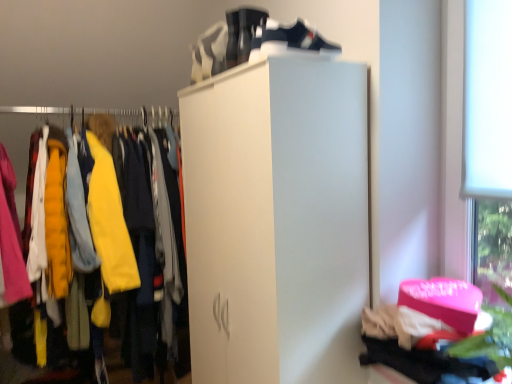
Measure the distance between point (276,28) and camera.

The distance of point (276,28) from camera is 1.25 meters.

Find the location of a particular element. The image size is (512, 384). white matte closet at left is located at coordinates (95, 218).

This screenshot has width=512, height=384. Identify the location of white matte running shoe at upper center. (242, 33).

How distant is white leather shoe at upper center from white matte running shoe at upper center?

A distance of 4.34 inches exists between white leather shoe at upper center and white matte running shoe at upper center.

Considering their positions, is white leather shoe at upper center located in front of or behind white matte running shoe at upper center?

Visually, white leather shoe at upper center is located in front of white matte running shoe at upper center.

Between white leather shoe at upper center and white matte running shoe at upper center, which one appears on the left side from the viewer's perspective?

white matte running shoe at upper center.

From a real-world perspective, which is physically below, white leather shoe at upper center or white matte running shoe at upper center?

From a 3D spatial view, white leather shoe at upper center is below.

From the picture: Can you confirm if white leather shoe at upper center is wider than white matte closet at left?

No.

Does point (291, 32) come in front of point (67, 189)?

Yes, point (291, 32) is in front of point (67, 189).

From the image's perspective, does white leather shoe at upper center appear lower than white matte closet at left?

Actually, white leather shoe at upper center appears above white matte closet at left in the image.

From a real-world perspective, is white leather shoe at upper center below white matte closet at left?

Incorrect, from a real-world perspective, white leather shoe at upper center is higher than white matte closet at left.

Is there a large distance between white matte running shoe at upper center and white leather shoe at upper center?

No, white matte running shoe at upper center is not far away from white leather shoe at upper center.

From the picture: Is white matte running shoe at upper center outside of white leather shoe at upper center?

white matte running shoe at upper center is positioned outside white leather shoe at upper center.

At what (x,y) coordinates should I click in order to perform the action: click on shoe on the right of white matte running shoe at upper center. Please return your answer as a coordinate pair (x, y). Looking at the image, I should click on (294, 38).

Does white matte closet at left have a smaller size compared to white matte running shoe at upper center?

No.

Could white matte running shoe at upper center be considered to be inside white matte closet at left?

That's incorrect, white matte running shoe at upper center is not inside white matte closet at left.

How many degrees apart are the facing directions of white matte closet at left and white matte running shoe at upper center?

There is a 90.1-degree angle between the facing directions of white matte closet at left and white matte running shoe at upper center.

Measure the distance from white matte closet at left to white matte running shoe at upper center.

They are 89.86 centimeters apart.

Does white matte closet at left come in front of white leather shoe at upper center?

That is False.

Considering the points (113, 170) and (298, 20), which point is in front, point (113, 170) or point (298, 20)?

The point (298, 20) is closer to the camera.

Is white matte closet at left turned away from white leather shoe at upper center?

No, white matte closet at left is not facing the opposite direction of white leather shoe at upper center.

Is point (231, 55) farther from viewer compared to point (122, 218)?

No, (231, 55) is closer to viewer.

In the image, is white matte running shoe at upper center positioned in front of or behind white matte closet at left?

Clearly, white matte running shoe at upper center is in front of white matte closet at left.

Locate an element on the screen. closet behind the white matte running shoe at upper center is located at coordinates (95, 218).

From a real-world perspective, relative to white matte closet at left, is white matte running shoe at upper center vertically above or below?

white matte running shoe at upper center is situated higher than white matte closet at left in the real world.

This screenshot has height=384, width=512. In the image, there is a white leather shoe at upper center. What are the coordinates of `running shoe above it (from the image's perspective)` in the screenshot? It's located at (242, 33).

You are a GUI agent. You are given a task and a screenshot of the screen. Output one action in this format:
    pyautogui.click(x=<x>, y=<y>)
    Task: Click on the closet that appears below the white leather shoe at upper center (from a real-world perspective)
    
    Given the screenshot: What is the action you would take?
    pyautogui.click(x=95, y=218)

Which object lies further to the anchor point white matte running shoe at upper center, white leather shoe at upper center or white matte closet at left?

white matte closet at left lies further to white matte running shoe at upper center than the other object.

Considering their positions, is white matte running shoe at upper center positioned further to white leather shoe at upper center than white matte closet at left?

white matte closet at left is positioned further to the anchor white leather shoe at upper center.

Considering their positions, is white leather shoe at upper center positioned further to white matte closet at left than white matte running shoe at upper center?

Among the two, white leather shoe at upper center is located further to white matte closet at left.

From the image, which object appears to be farther from white matte running shoe at upper center, white matte closet at left or white leather shoe at upper center?

Based on the image, white matte closet at left appears to be further to white matte running shoe at upper center.

When comparing their distances from white leather shoe at upper center, does white matte closet at left or white matte running shoe at upper center seem closer?

white matte running shoe at upper center lies closer to white leather shoe at upper center than the other object.

Which object lies further to the anchor point white matte closet at left, white matte running shoe at upper center or white leather shoe at upper center?

The object further to white matte closet at left is white leather shoe at upper center.

You are a GUI agent. You are given a task and a screenshot of the screen. Output one action in this format:
    pyautogui.click(x=<x>, y=<y>)
    Task: Click on the shoe between white matte running shoe at upper center and white matte closet at left vertically
    Image resolution: width=512 pixels, height=384 pixels.
    Given the screenshot: What is the action you would take?
    pyautogui.click(x=294, y=38)